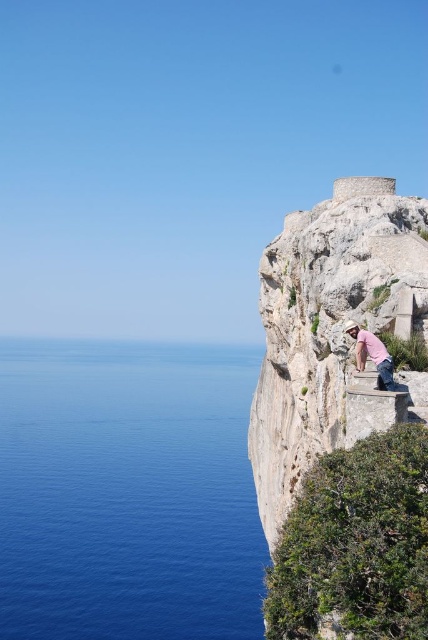
You are a hiker who wants to take a photo of the blue water at left and the pink cotton shirt at center in the same frame. Which object should you focus on first if you want to ensure both are in focus?

The blue water at left is taller than the pink cotton shirt at center, so you should focus on the blue water at left first to ensure both are in focus.

You are a hiker who wants to take a photo of the blue water at left and the rough stone cliff at right. Based on their sizes in the image, which one should you focus on first to ensure both are in frame?

The blue water at left has a larger size compared to the rough stone cliff at right, so you should focus on the blue water at left first to ensure both are in frame.